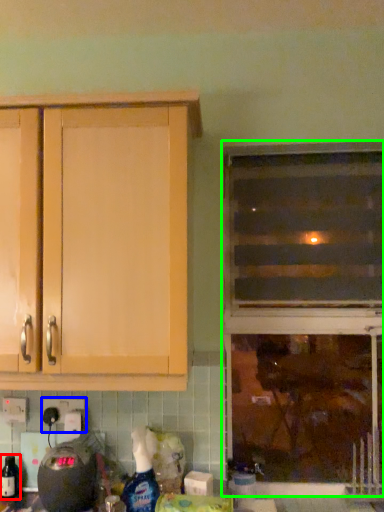
Question: Based on their relative distances, which object is farther from bottle (highlighted by a red box)? Choose from electric outlet (highlighted by a blue box) and window (highlighted by a green box).

Choices:
 (A) electric outlet
 (B) window

Answer: (B)